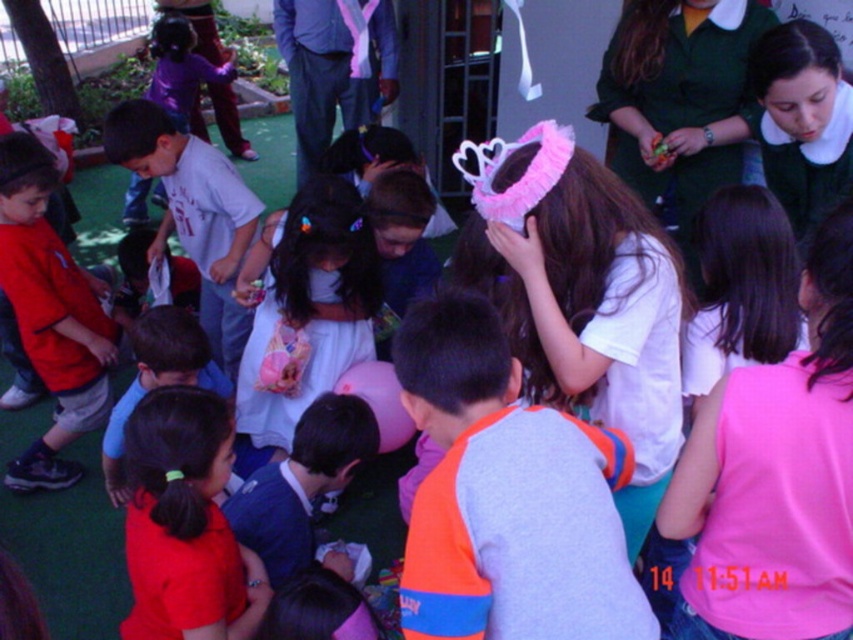
You are a photographer trying to capture a photo of the children in the schoolyard. You want to ensure that both the white satin dress at center and the matte red shirt at left are visible in the frame. Based on their positions, which child should you focus on first to make sure both are in the shot?

The white satin dress at center is above the matte red shirt at left, so you should focus on the white satin dress at center first to ensure both are in the frame.

You are a photographer standing at the center of the schoolyard. You want to take a photo that includes both the point at (280,419) and the point at (64,348). Which point is closer to the camera so that it will appear larger in the photo?

Point at (280,419) is closer to the camera than point at (64,348), so it will appear larger in the photo.

You are standing in the schoolyard and want to hand a note to the child wearing the white satin dress at center. If you can reach up to 2 meters, will you be able to reach them?

The white satin dress at center is 2.39 meters away from the viewer. Since your reach is up to 2 meters, you cannot reach them without moving closer.